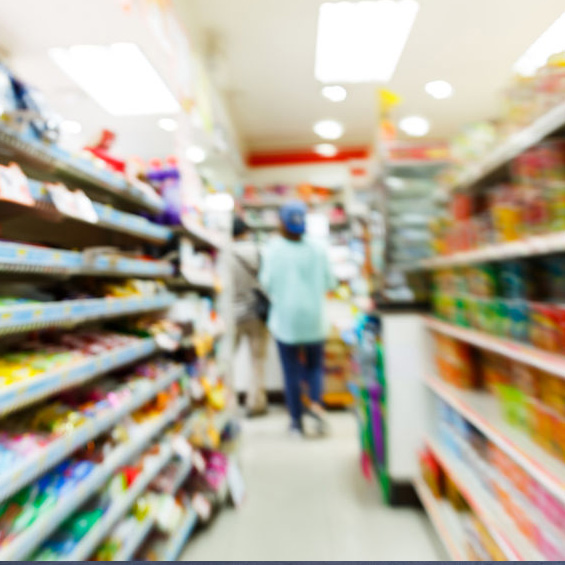
Identify the location of ceiling. (263, 62).